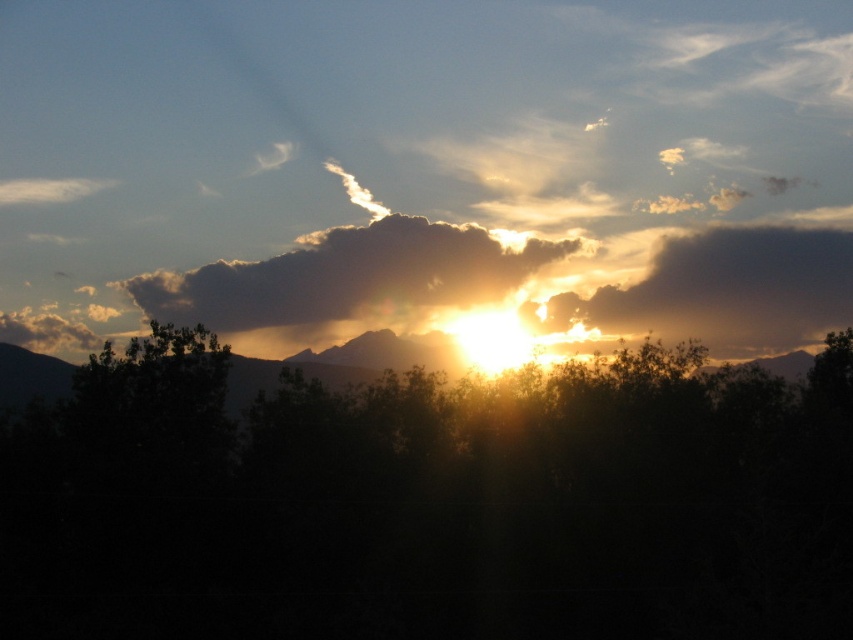
Question: Is golden translucent cloud at center thinner than golden translucent cloud at upper right?

Choices:
 (A) yes
 (B) no

Answer: (B)

Question: Which is farther from the golden translucent cloud at center?

Choices:
 (A) golden translucent cloud at upper right
 (B) green leafy tree at center

Answer: (B)

Question: Can you confirm if green leafy tree at center is smaller than golden translucent cloud at center?

Choices:
 (A) no
 (B) yes

Answer: (A)

Question: Which of the following is the farthest from the observer?

Choices:
 (A) golden translucent cloud at center
 (B) golden translucent cloud at upper right
 (C) green leafy tree at center

Answer: (B)

Question: Does green leafy tree at center appear over golden translucent cloud at upper right?

Choices:
 (A) yes
 (B) no

Answer: (B)

Question: Which object is the closest to the golden translucent cloud at upper right?

Choices:
 (A) green leafy tree at center
 (B) golden translucent cloud at center

Answer: (B)